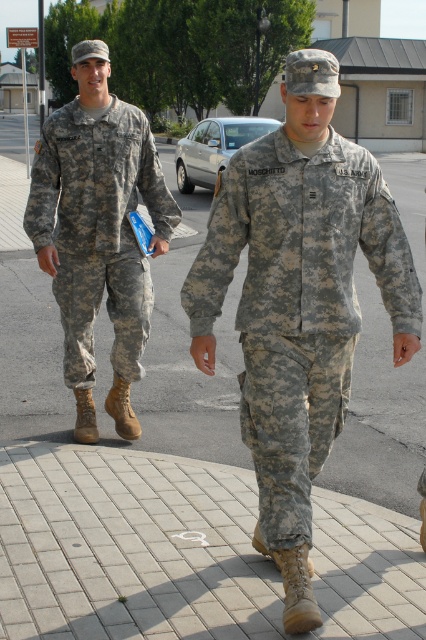
Question: Which point is closer to the camera taking this photo?

Choices:
 (A) (396, 340)
 (B) (190, 353)
 (C) (316, 180)
 (D) (69, 326)

Answer: (C)

Question: Is camouflage fabric uniform at center below matte skin hand at center?

Choices:
 (A) no
 (B) yes

Answer: (A)

Question: Does camouflage fabric uniform at center appear under matte skin hand at center?

Choices:
 (A) yes
 (B) no

Answer: (B)

Question: Which of these objects is positioned closest to the camouflage fabric uniform at center?

Choices:
 (A) matte skin hand at center
 (B) light skin tone flesh at center

Answer: (B)

Question: Does camouflage fabric uniform at center have a lesser width compared to matte skin hand at center?

Choices:
 (A) no
 (B) yes

Answer: (A)

Question: Which object is closer to the camera taking this photo?

Choices:
 (A) light skin tone flesh at center
 (B) matte skin hand at center
 (C) camouflage fabric uniform at left

Answer: (A)